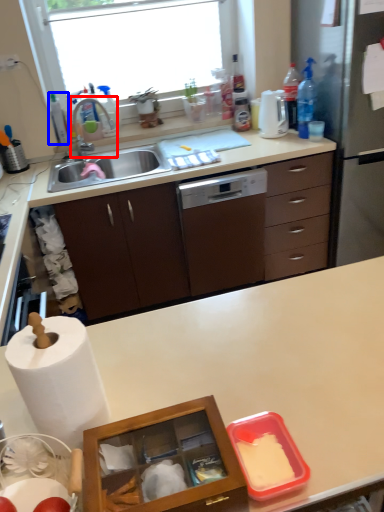
Question: Among these objects, which one is farthest to the camera, faucet (highlighted by a red box) or bottle (highlighted by a blue box)?

Choices:
 (A) faucet
 (B) bottle

Answer: (B)